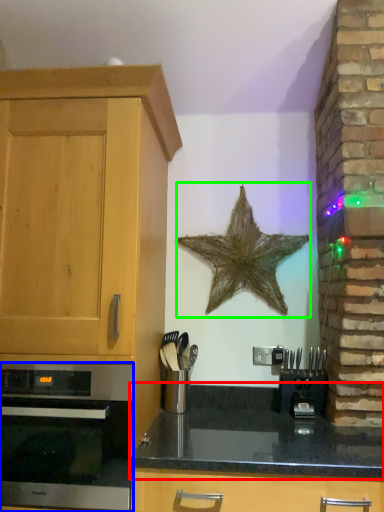
Question: Based on their relative distances, which object is farther from countertop (highlighted by a red box)? Choose from oven (highlighted by a blue box) and starfish (highlighted by a green box).

Choices:
 (A) oven
 (B) starfish

Answer: (B)